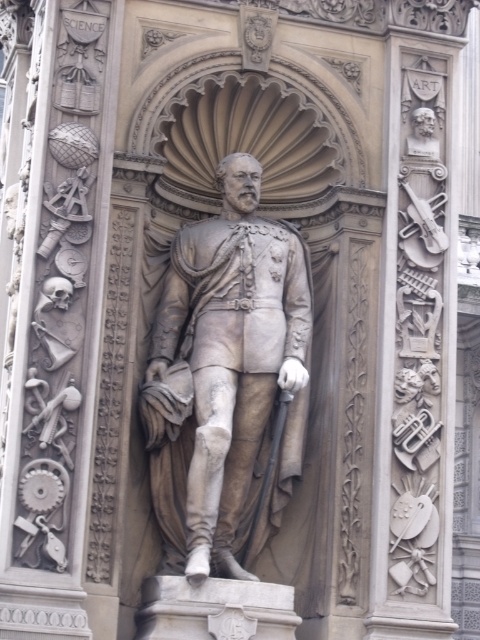
Question: Which point is farther from the camera taking this photo?

Choices:
 (A) [229, 208]
 (B) [429, 108]

Answer: (B)

Question: Among these points, which one is farthest from the camera?

Choices:
 (A) click(421, 129)
 (B) click(276, 346)

Answer: (A)

Question: Is gray stone statue at center thinner than gray stone bust at upper right?

Choices:
 (A) no
 (B) yes

Answer: (A)

Question: Is gray stone statue at center bigger than gray stone bust at upper right?

Choices:
 (A) no
 (B) yes

Answer: (B)

Question: Does gray stone statue at center have a larger size compared to gray stone bust at upper right?

Choices:
 (A) no
 (B) yes

Answer: (B)